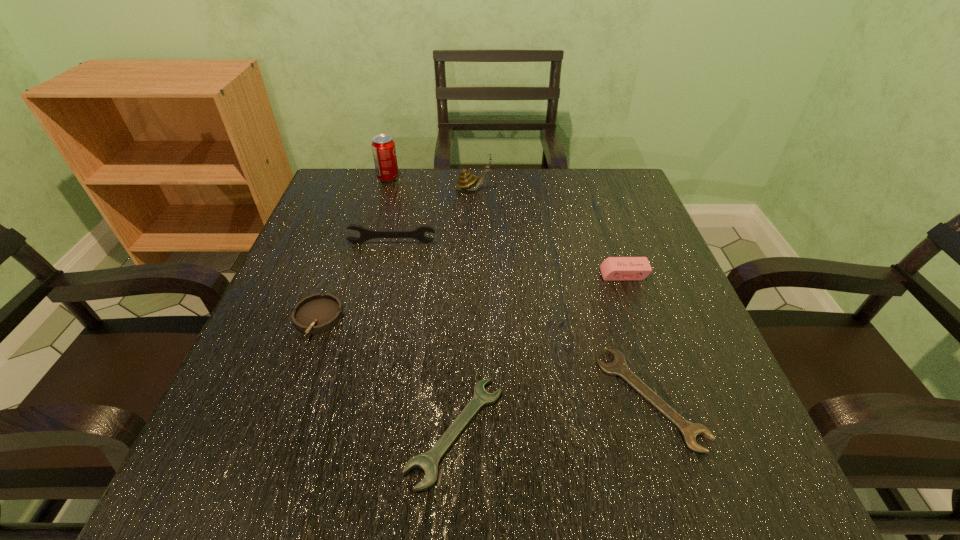
Where is `eraser at the right edge`? The width and height of the screenshot is (960, 540). eraser at the right edge is located at coordinates (613, 268).

At what (x,y) coordinates should I click in order to perform the action: click on wrench located at the right edge. Please return your answer as a coordinate pair (x, y). This screenshot has width=960, height=540. Looking at the image, I should click on (618, 367).

The width and height of the screenshot is (960, 540). Find the location of `object present at the far left corner`. object present at the far left corner is located at coordinates point(383,147).

Image resolution: width=960 pixels, height=540 pixels. I want to click on object situated at the near right corner, so click(x=618, y=367).

This screenshot has width=960, height=540. In the image, there is a desktop. Identify the location of free region at the far edge. (509, 202).

In the image, there is a desktop. Where is `vacant space at the near edge`? The width and height of the screenshot is (960, 540). vacant space at the near edge is located at coordinates (551, 506).

The image size is (960, 540). I want to click on vacant space at the left edge of the desktop, so click(321, 242).

Find the location of a particular element. The image size is (960, 540). free location at the right edge is located at coordinates (601, 242).

The image size is (960, 540). Find the location of `blank space at the far left corner`. blank space at the far left corner is located at coordinates (368, 210).

In the image, there is a desktop. Identify the location of vacant space at the far right corner. This screenshot has height=540, width=960. (601, 187).